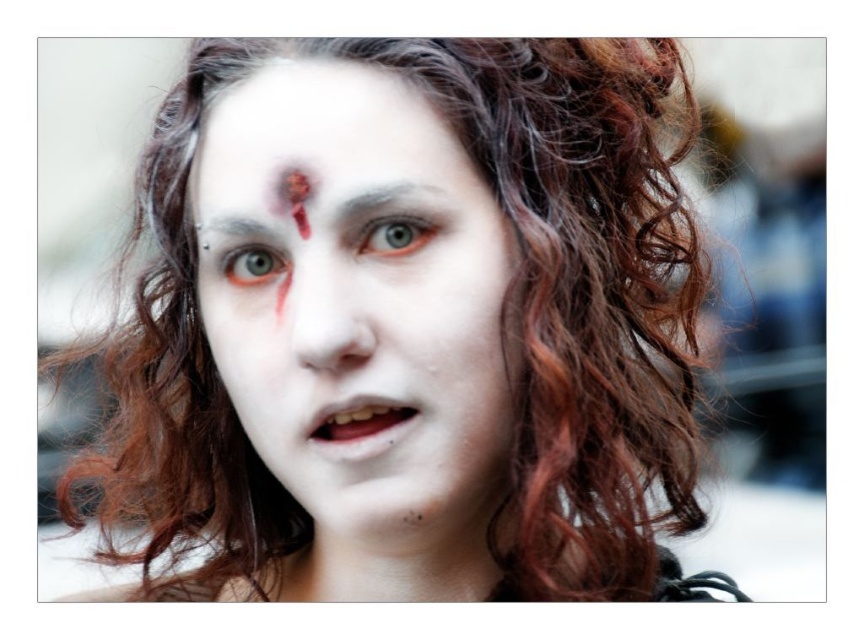
Is white matte face paint at center wider than dark brown eyebrow at upper center?

Correct, the width of white matte face paint at center exceeds that of dark brown eyebrow at upper center.

Is point (669, 100) closer to camera compared to point (434, 189)?

No, (669, 100) is behind (434, 189).

Where is `white matte face paint at center`? white matte face paint at center is located at coordinates (411, 328).

Does point (207, 228) lie behind point (238, 284)?

No, it is in front of (238, 284).

Which of these two, matte black eyebrow at upper center or matte green eye at upper left, stands taller?

With more height is matte green eye at upper left.

Who is more forward, (202, 234) or (242, 250)?

Positioned in front is point (242, 250).

This screenshot has width=864, height=640. I want to click on matte black eyebrow at upper center, so click(234, 228).

Does point (329, 289) lie behind point (369, 227)?

No, it is in front of (369, 227).

Who is more forward, (309, 369) or (396, 240)?

Point (309, 369)

You are a GUI agent. You are given a task and a screenshot of the screen. Output one action in this format:
    pyautogui.click(x=<x>, y=<y>)
    Task: Click on the smooth flesh nose at center
    This screenshot has width=864, height=640.
    Given the screenshot: What is the action you would take?
    pyautogui.click(x=324, y=316)